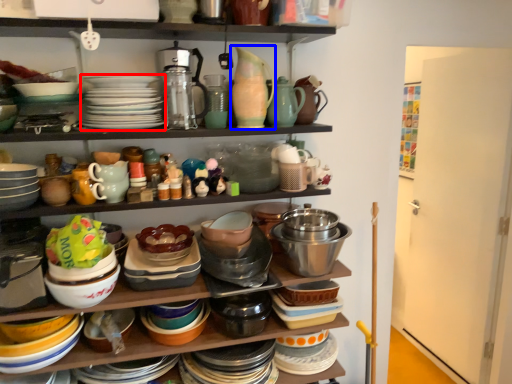
Question: Among these objects, which one is nearest to the camera, platter (highlighted by a red box) or tableware (highlighted by a blue box)?

Choices:
 (A) platter
 (B) tableware

Answer: (A)